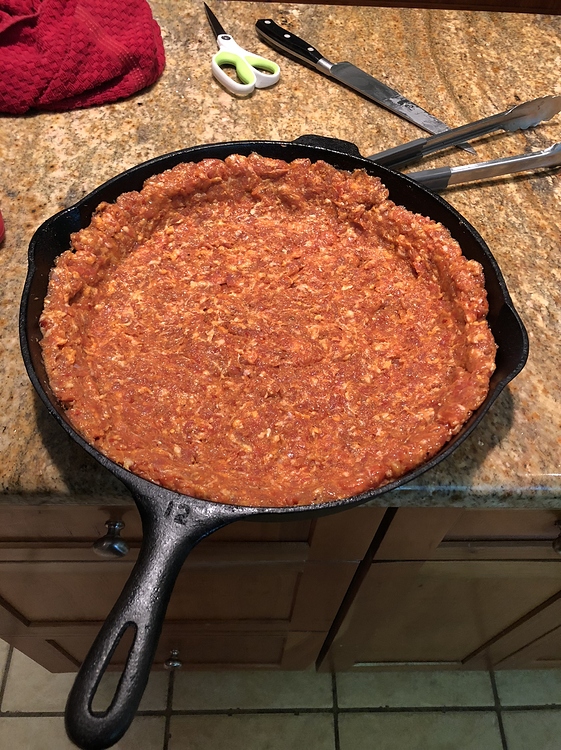
Identify the location of drawer. This screenshot has width=561, height=750. (86, 535).